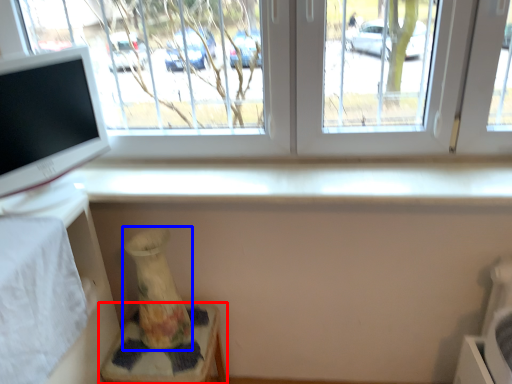
Question: Which object is closer to the camera taking this photo, furniture (highlighted by a red box) or vase (highlighted by a blue box)?

Choices:
 (A) furniture
 (B) vase

Answer: (B)